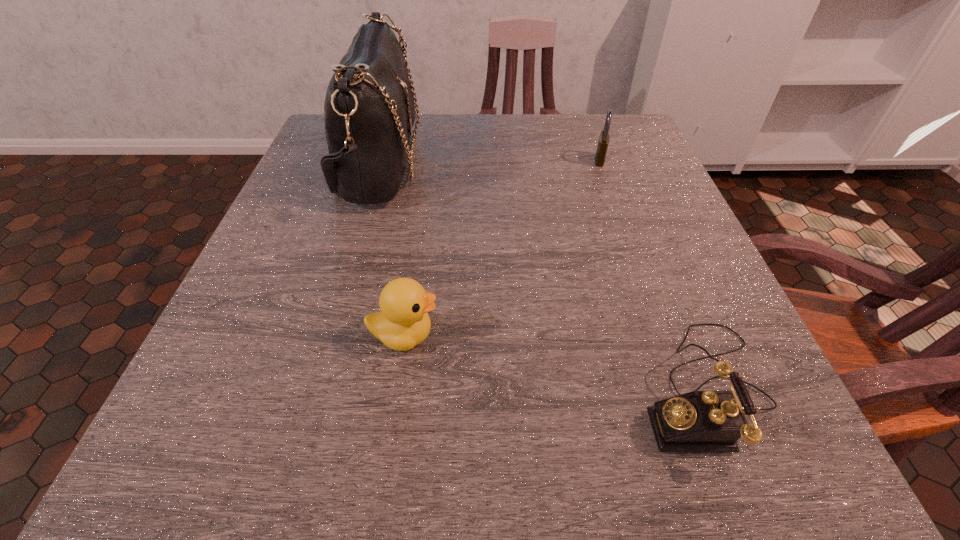
Locate an element on the screen. This screenshot has width=960, height=540. unoccupied position between the telephone and the padlock is located at coordinates (652, 274).

Identify the location of free space between the handbag and the telephone. The width and height of the screenshot is (960, 540). (541, 276).

Where is `free space between the padlock and the telephone`? Image resolution: width=960 pixels, height=540 pixels. free space between the padlock and the telephone is located at coordinates (652, 274).

You are a GUI agent. You are given a task and a screenshot of the screen. Output one action in this format:
    pyautogui.click(x=<x>, y=<y>)
    Task: Click on the free area in between the padlock and the telephone
    
    Given the screenshot: What is the action you would take?
    pyautogui.click(x=652, y=274)

This screenshot has height=540, width=960. What are the coordinates of `object that is the closest to the duck` in the screenshot? It's located at (369, 109).

Identify which object is the nearest to the telephone. Please provide its 2D coordinates. Your answer should be formatted as a tuple, i.e. [(x, y)], where the tuple contains the x and y coordinates of a point satisfying the conditions above.

[(403, 322)]

The height and width of the screenshot is (540, 960). I want to click on free point that satisfies the following two spatial constraints: 1. on the front side of the padlock; 2. on the face of the duck, so click(x=661, y=335).